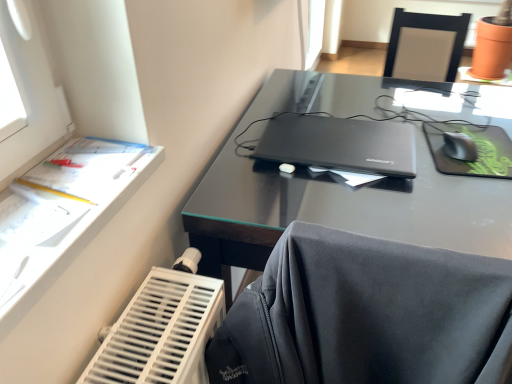
I want to click on free space that is in between matte black laptop at center and black plastic mouse at right, so click(426, 154).